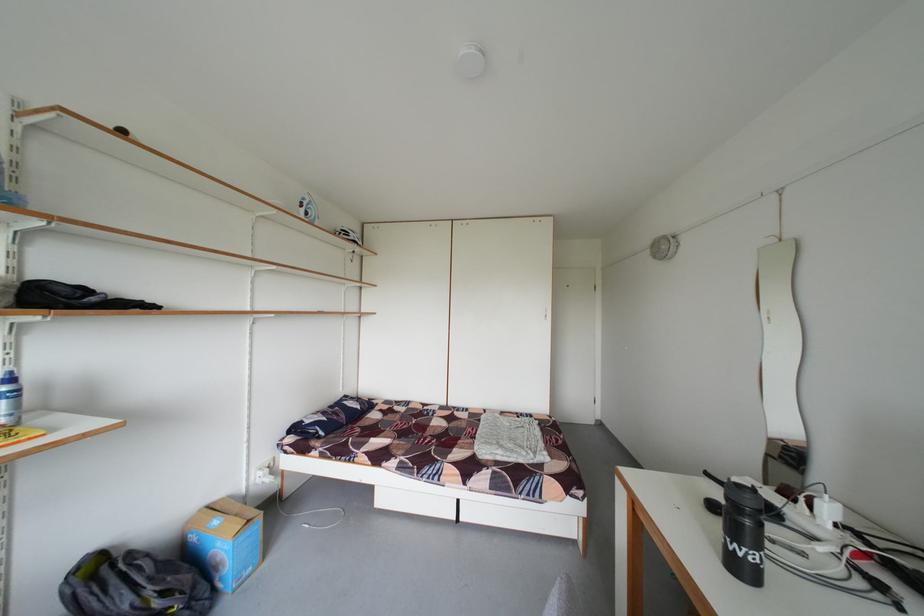
Locate an element on the screen. The height and width of the screenshot is (616, 924). white drawer handle is located at coordinates (539, 517).